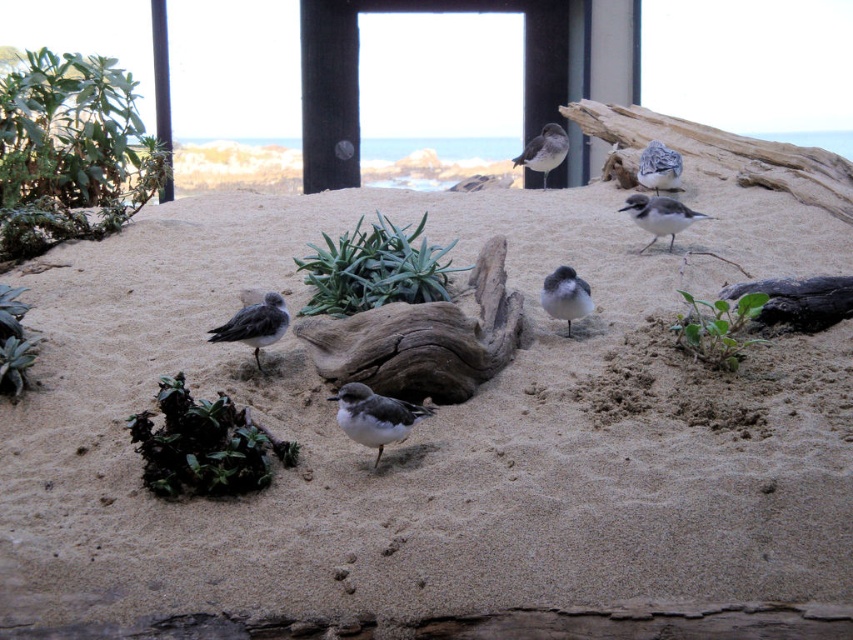
Question: Which of these objects is positioned farthest from the gray speckled bird at upper center?

Choices:
 (A) white glossy bird at center
 (B) green succulent at upper left
 (C) white matte bird at center

Answer: (B)

Question: Where is white matte bird at center located in relation to gray speckled bird at upper center in the image?

Choices:
 (A) left
 (B) right

Answer: (B)

Question: Which object is positioned farthest from the gray matte bird at upper right?

Choices:
 (A) green succulent at lower left
 (B) white glossy bird at center
 (C) sandy beach at center

Answer: (A)

Question: Which is farther from the gray speckled bird at upper center?

Choices:
 (A) green succulent at lower left
 (B) gray matte bird at lower left

Answer: (A)

Question: Does gray matte bird at lower left appear on the left side of white matte bird at center?

Choices:
 (A) yes
 (B) no

Answer: (A)

Question: Is green succulent at upper left in front of gray speckled bird at upper center?

Choices:
 (A) no
 (B) yes

Answer: (B)